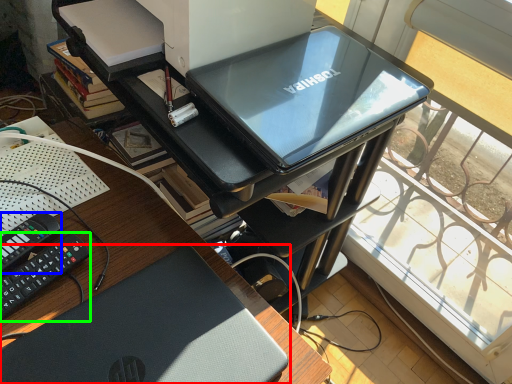
Question: Considering the real-world distances, which object is farthest from laptop (highlighted by a red box)? equipment (highlighted by a blue box) or equipment (highlighted by a green box)?

Choices:
 (A) equipment
 (B) equipment

Answer: (A)